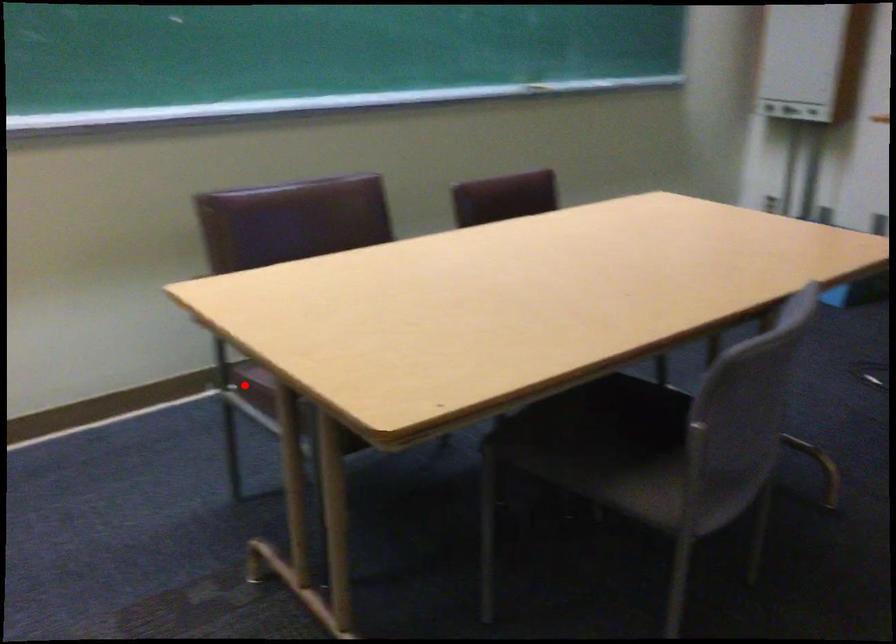
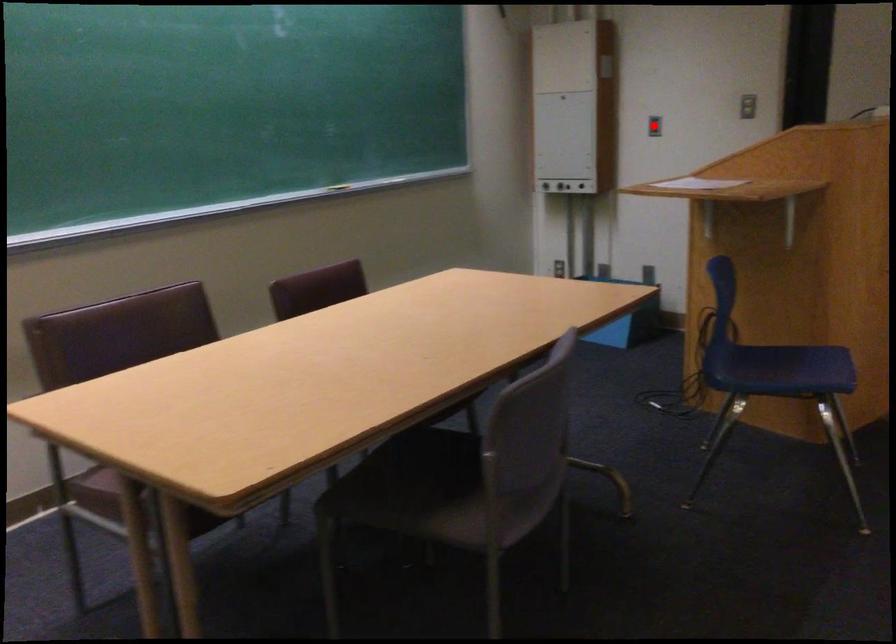
I am providing you with two images of the same scene from different viewpoints. A red point is marked on the first image and another point is marked on the second image. Are the points marked in image1 and image2 representing the same 3D position?

No